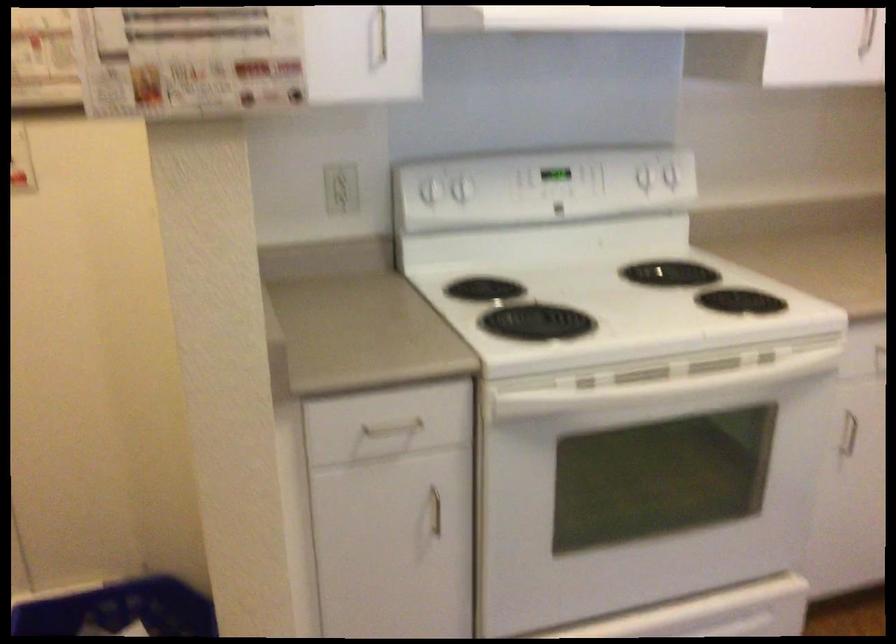
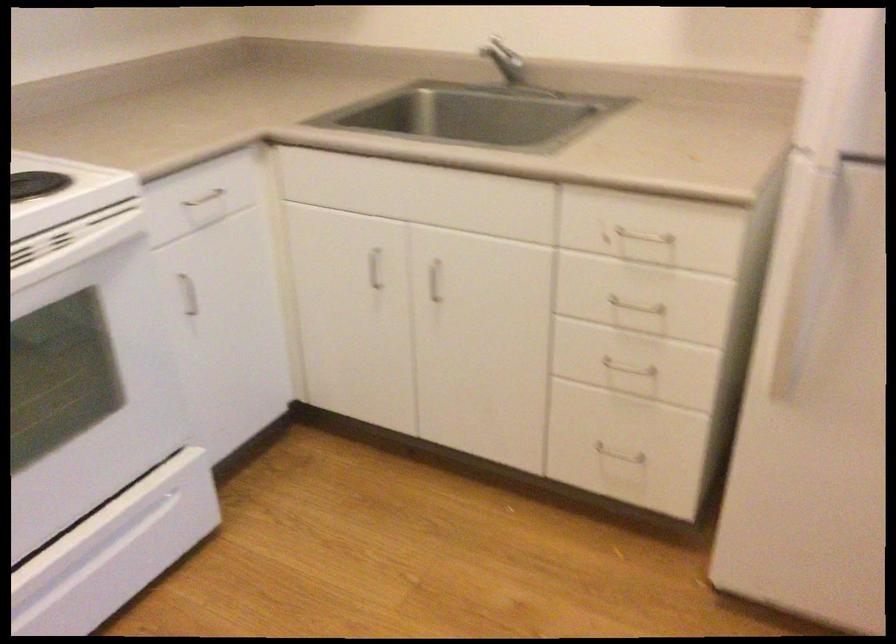
Locate, in the second image, the point that corresponds to the point at 772,371 in the first image.

(73, 243)